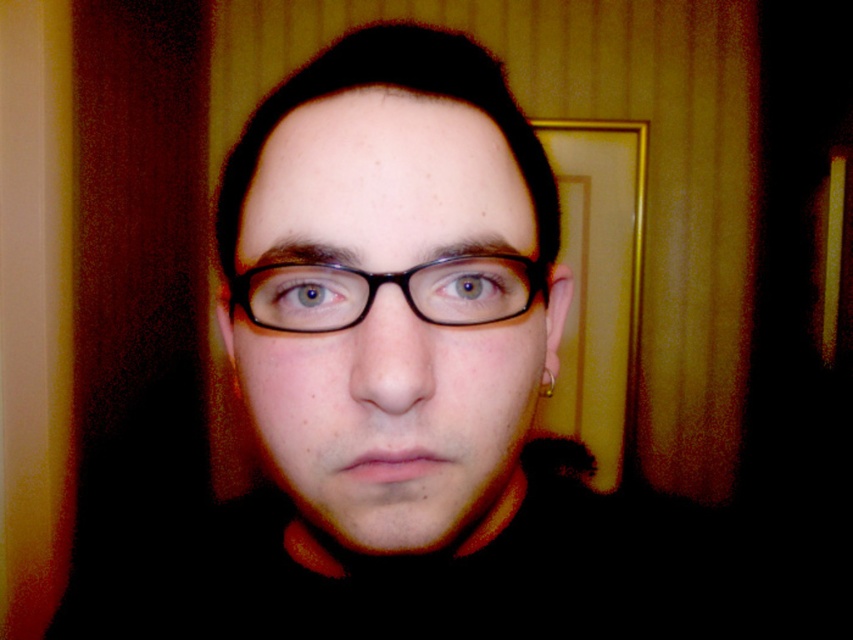
Between black plastic glasses at center and blue glossy eye at center, which one appears on the right side from the viewer's perspective?

From the viewer's perspective, black plastic glasses at center appears more on the right side.

From the picture: Can you confirm if black plastic glasses at center is wider than blue glossy eye at center?

Correct, the width of black plastic glasses at center exceeds that of blue glossy eye at center.

The image size is (853, 640). Describe the element at coordinates (387, 282) in the screenshot. I see `black plastic glasses at center` at that location.

Identify the location of black plastic glasses at center. (387, 282).

Does black matte glasses at center have a smaller size compared to black plastic glasses at center?

No.

From the picture: Between black matte glasses at center and black plastic glasses at center, which one has less height?

Standing shorter between the two is black plastic glasses at center.

Identify the location of black matte glasses at center. (390, 317).

Is point (410, 208) less distant than point (300, 291)?

Yes, it is in front of point (300, 291).

Can you confirm if black matte glasses at center is taller than blue glossy eye at center?

Yes.

Is point (401, 259) more distant than point (267, 300)?

No, it is not.

This screenshot has height=640, width=853. I want to click on black matte glasses at center, so click(390, 317).